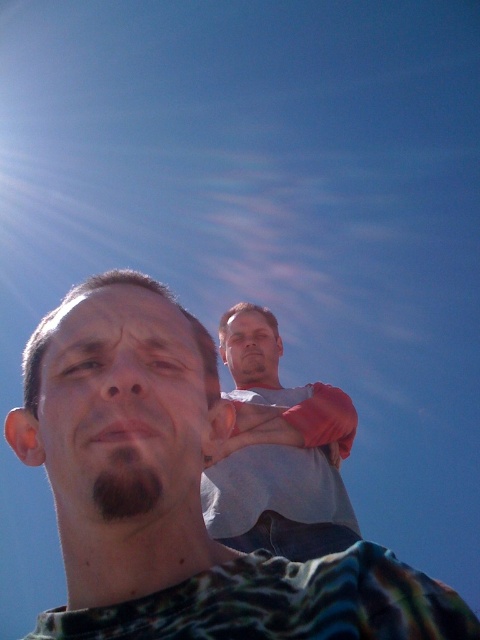
Question: Which object is closer to the camera taking this photo?

Choices:
 (A) gray cotton shirt at center
 (B) smooth skin head at upper center

Answer: (A)

Question: Is the position of gray cotton shirt at center more distant than that of smooth skin head at upper center?

Choices:
 (A) yes
 (B) no

Answer: (B)

Question: From the image, what is the correct spatial relationship of camouflage shirt at center in relation to smooth skin head at upper center?

Choices:
 (A) right
 (B) left

Answer: (B)

Question: Estimate the real-world distances between objects in this image. Which object is farther from the smooth skin head at upper center?

Choices:
 (A) matte skin head at center
 (B) camouflage shirt at center
 (C) gray cotton shirt at center

Answer: (B)

Question: Which point appears closest to the camera in this image?

Choices:
 (A) (245, 385)
 (B) (41, 352)
 (C) (276, 380)

Answer: (B)

Question: Is gray cotton shirt at center closer to the viewer compared to matte skin head at center?

Choices:
 (A) no
 (B) yes

Answer: (A)